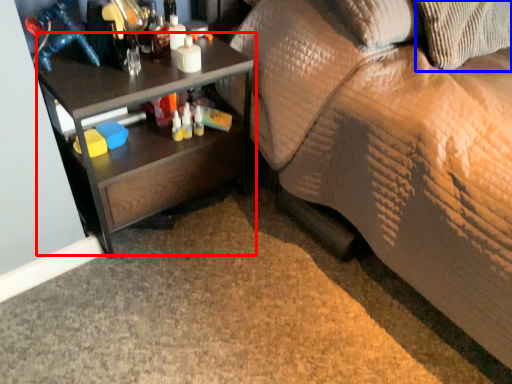
Question: Which point is closer to the camera, desk (highlighted by a red box) or pillow (highlighted by a blue box)?

Choices:
 (A) desk
 (B) pillow

Answer: (A)